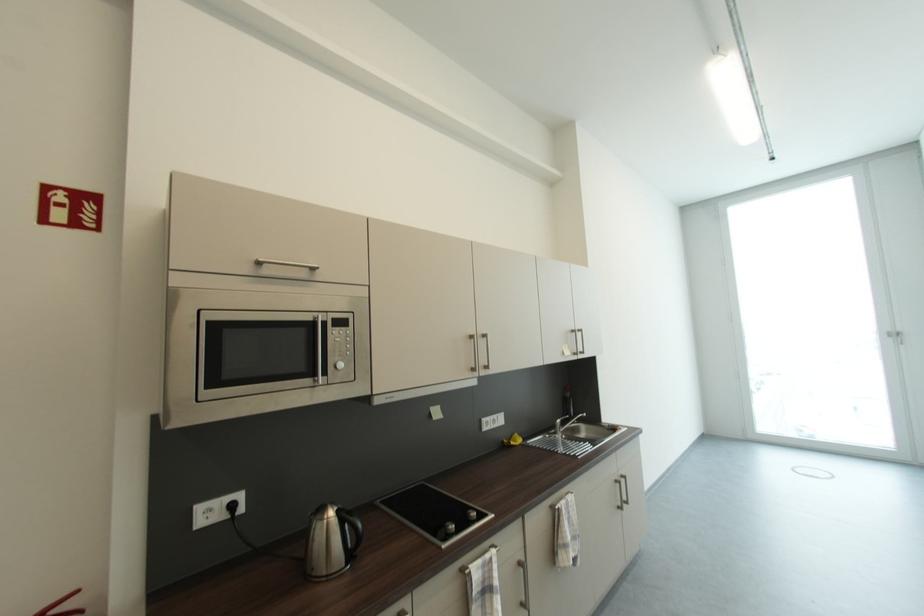
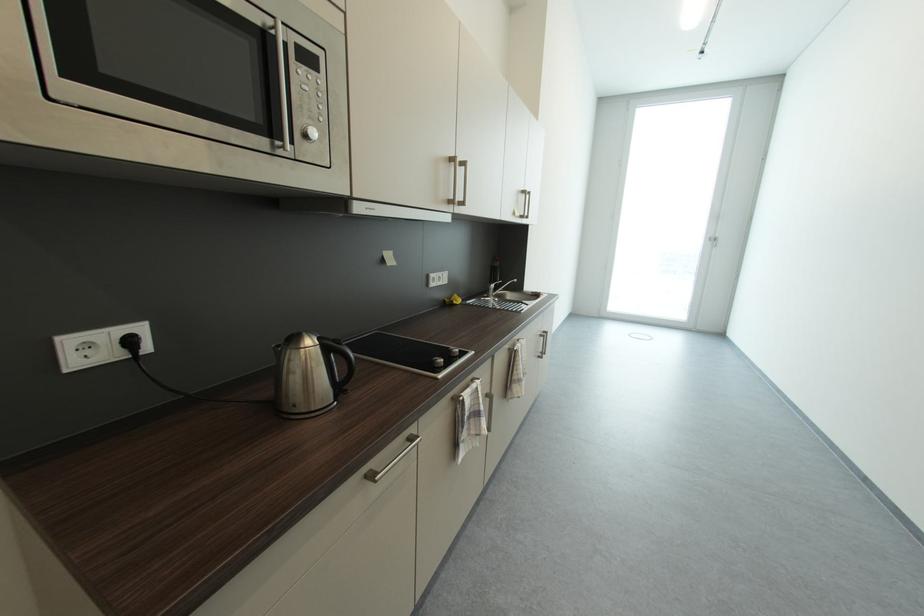
Where in the second image is the point corresponding to point 579,331 from the first image?

(529, 193)